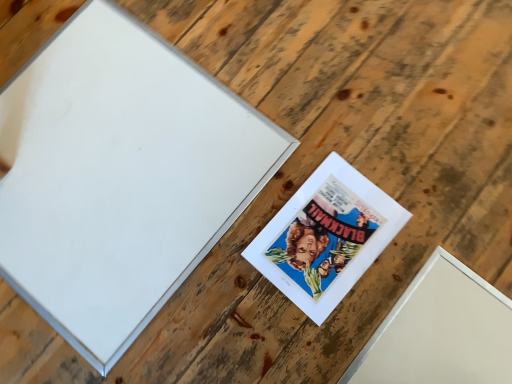
Question: Does matte paper picture frame at center, placed as the 2th picture frame when sorted from left to right, have a smaller size compared to white matte picture frame at upper left, placed as the 2th picture frame when sorted from right to left?

Choices:
 (A) no
 (B) yes

Answer: (B)

Question: Considering the relative sizes of matte paper picture frame at center, arranged as the first picture frame when viewed from the right, and white matte picture frame at upper left, which is counted as the first picture frame, starting from the left, in the image provided, is matte paper picture frame at center, arranged as the first picture frame when viewed from the right, thinner than white matte picture frame at upper left, which is counted as the first picture frame, starting from the left,?

Choices:
 (A) yes
 (B) no

Answer: (A)

Question: Can you confirm if matte paper picture frame at center, placed as the 2th picture frame when sorted from left to right, is shorter than white matte picture frame at upper left, placed as the 2th picture frame when sorted from right to left?

Choices:
 (A) no
 (B) yes

Answer: (B)

Question: Could you tell me if matte paper picture frame at center, arranged as the first picture frame when viewed from the right, is turned towards white matte picture frame at upper left, placed as the 2th picture frame when sorted from right to left?

Choices:
 (A) no
 (B) yes

Answer: (A)

Question: Can you confirm if matte paper picture frame at center, placed as the 2th picture frame when sorted from left to right, is positioned to the left of white matte picture frame at upper left, placed as the 2th picture frame when sorted from right to left?

Choices:
 (A) yes
 (B) no

Answer: (B)

Question: Could white matte picture frame at upper left, placed as the 2th picture frame when sorted from right to left, be considered to be inside matte paper picture frame at center, placed as the 2th picture frame when sorted from left to right?

Choices:
 (A) yes
 (B) no

Answer: (B)

Question: Considering the relative positions of white matte picture frame at upper left, which is counted as the first picture frame, starting from the left, and matte paper picture frame at center, placed as the 2th picture frame when sorted from left to right, in the image provided, is white matte picture frame at upper left, which is counted as the first picture frame, starting from the left, to the right of matte paper picture frame at center, placed as the 2th picture frame when sorted from left to right, from the viewer's perspective?

Choices:
 (A) yes
 (B) no

Answer: (B)

Question: Is white matte picture frame at upper left, which is counted as the first picture frame, starting from the left, positioned far away from matte paper picture frame at center, placed as the 2th picture frame when sorted from left to right?

Choices:
 (A) no
 (B) yes

Answer: (A)

Question: Can you confirm if white matte picture frame at upper left, which is counted as the first picture frame, starting from the left, is positioned to the left of matte paper picture frame at center, placed as the 2th picture frame when sorted from left to right?

Choices:
 (A) no
 (B) yes

Answer: (B)

Question: Is white matte picture frame at upper left, placed as the 2th picture frame when sorted from right to left, facing towards matte paper picture frame at center, placed as the 2th picture frame when sorted from left to right?

Choices:
 (A) yes
 (B) no

Answer: (B)

Question: Can you confirm if white matte picture frame at upper left, placed as the 2th picture frame when sorted from right to left, is wider than matte paper picture frame at center, arranged as the first picture frame when viewed from the right?

Choices:
 (A) yes
 (B) no

Answer: (A)

Question: Is the position of white matte picture frame at upper left, placed as the 2th picture frame when sorted from right to left, more distant than that of matte paper picture frame at center, arranged as the first picture frame when viewed from the right?

Choices:
 (A) yes
 (B) no

Answer: (B)

Question: Would you say matte paper picture frame at center, arranged as the first picture frame when viewed from the right, is to the left or to the right of white matte picture frame at upper left, which is counted as the first picture frame, starting from the left, in the picture?

Choices:
 (A) left
 (B) right

Answer: (B)